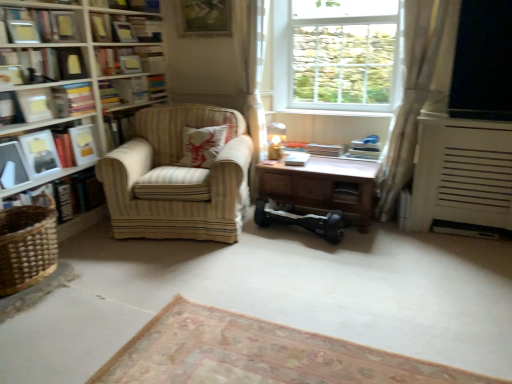
Question: Is hardcover book at center, marked as the first paperback book in a right-to-left arrangement, looking in the opposite direction of transparent glass window screen at upper right?

Choices:
 (A) yes
 (B) no

Answer: (B)

Question: Considering the relative sizes of hardcover book at center, which is counted as the third paperback book, starting from the left, and transparent glass window screen at upper right in the image provided, is hardcover book at center, which is counted as the third paperback book, starting from the left, wider than transparent glass window screen at upper right?

Choices:
 (A) yes
 (B) no

Answer: (A)

Question: From a real-world perspective, is hardcover book at center, which is counted as the third paperback book, starting from the left, positioned over transparent glass window screen at upper right based on gravity?

Choices:
 (A) no
 (B) yes

Answer: (A)

Question: From the image's perspective, does hardcover book at center, marked as the first paperback book in a right-to-left arrangement, appear higher than transparent glass window screen at upper right?

Choices:
 (A) no
 (B) yes

Answer: (A)

Question: Does hardcover book at center, which is counted as the third paperback book, starting from the left, have a greater height compared to transparent glass window screen at upper right?

Choices:
 (A) yes
 (B) no

Answer: (B)

Question: Is point (397, 134) positioned closer to the camera than point (203, 155)?

Choices:
 (A) closer
 (B) farther

Answer: (A)

Question: Considering the positions of white sheer curtain at right, which is counted as the first curtain, starting from the right, and white textured pillow at center in the image, is white sheer curtain at right, which is counted as the first curtain, starting from the right, wider or thinner than white textured pillow at center?

Choices:
 (A) wide
 (B) thin

Answer: (A)

Question: From the image's perspective, is white sheer curtain at right, which is counted as the first curtain, starting from the right, located above or below white textured pillow at center?

Choices:
 (A) above
 (B) below

Answer: (A)

Question: From a real-world perspective, relative to white textured pillow at center, is white sheer curtain at right, the second curtain positioned from the left, vertically above or below?

Choices:
 (A) below
 (B) above

Answer: (B)

Question: Is hardcover book at center, the 7th book from the left, in front of or behind carpet at center, marked as the 1th plain in a front-to-back arrangement, in the image?

Choices:
 (A) front
 (B) behind

Answer: (B)

Question: From the image's perspective, is hardcover book at center, the 7th book from the left, positioned above or below carpet at center, the second plain viewed from the back?

Choices:
 (A) above
 (B) below

Answer: (A)

Question: Considering the positions of hardcover book at center, the 7th book from the left, and carpet at center, marked as the 1th plain in a front-to-back arrangement, in the image, is hardcover book at center, the 7th book from the left, taller or shorter than carpet at center, marked as the 1th plain in a front-to-back arrangement,?

Choices:
 (A) short
 (B) tall

Answer: (B)

Question: Based on their sizes in the image, would you say hardcover book at center, the 1th book positioned from the right, is bigger or smaller than carpet at center, the second plain viewed from the back?

Choices:
 (A) big
 (B) small

Answer: (B)

Question: Based on their positions, is brown wooden table at center located to the left or right of wooden picture frame at upper center?

Choices:
 (A) right
 (B) left

Answer: (A)

Question: In the image, is brown wooden table at center positioned in front of or behind wooden picture frame at upper center?

Choices:
 (A) front
 (B) behind

Answer: (A)